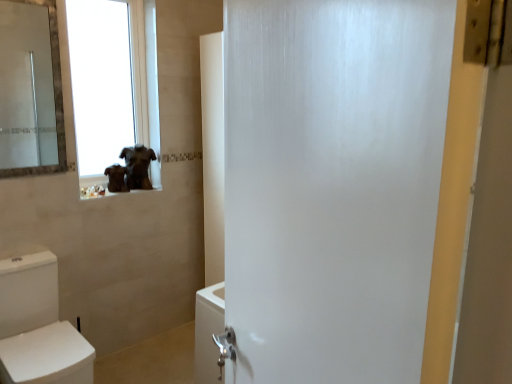
Question: Considering the relative sizes of transparent glass window at upper left and brown matte statue at upper left, marked as the 1th animal in a right-to-left arrangement, in the image provided, is transparent glass window at upper left taller than brown matte statue at upper left, marked as the 1th animal in a right-to-left arrangement,?

Choices:
 (A) no
 (B) yes

Answer: (B)

Question: Can you confirm if transparent glass window at upper left is positioned to the right of brown matte statue at upper left, the second animal positioned from the left?

Choices:
 (A) no
 (B) yes

Answer: (A)

Question: From the image's perspective, is transparent glass window at upper left above brown matte statue at upper left, marked as the 1th animal in a right-to-left arrangement?

Choices:
 (A) no
 (B) yes

Answer: (B)

Question: From a real-world perspective, is transparent glass window at upper left physically below brown matte statue at upper left, the second animal positioned from the left?

Choices:
 (A) yes
 (B) no

Answer: (B)

Question: From a real-world perspective, is transparent glass window at upper left on top of brown matte statue at upper left, marked as the 1th animal in a right-to-left arrangement?

Choices:
 (A) no
 (B) yes

Answer: (B)

Question: Considering the positions of brown matte statue at upper left, the second animal positioned from the left, and transparent glass window at upper left in the image, is brown matte statue at upper left, the second animal positioned from the left, wider or thinner than transparent glass window at upper left?

Choices:
 (A) wide
 (B) thin

Answer: (A)

Question: From the image's perspective, is brown matte statue at upper left, the second animal positioned from the left, located above or below transparent glass window at upper left?

Choices:
 (A) above
 (B) below

Answer: (B)

Question: Is point (135, 152) positioned closer to the camera than point (131, 1)?

Choices:
 (A) farther
 (B) closer

Answer: (A)

Question: From a real-world perspective, is brown matte statue at upper left, marked as the 1th animal in a right-to-left arrangement, physically located above or below transparent glass window at upper left?

Choices:
 (A) above
 (B) below

Answer: (B)

Question: In terms of width, does brown fur dog at upper left, which is counted as the second animal, starting from the right, look wider or thinner when compared to white glossy toilet at lower left?

Choices:
 (A) wide
 (B) thin

Answer: (B)

Question: Is brown fur dog at upper left, which is counted as the second animal, starting from the right, inside or outside of white glossy toilet at lower left?

Choices:
 (A) inside
 (B) outside

Answer: (B)

Question: Is brown fur dog at upper left, which is counted as the second animal, starting from the right, taller or shorter than white glossy toilet at lower left?

Choices:
 (A) short
 (B) tall

Answer: (A)

Question: In the image, is brown fur dog at upper left, the first animal viewed from the left, on the left side or the right side of white glossy toilet at lower left?

Choices:
 (A) left
 (B) right

Answer: (B)

Question: Considering the relative positions of brown fur dog at upper left, which is counted as the second animal, starting from the right, and brown matte statue at upper left, the second animal positioned from the left, in the image provided, is brown fur dog at upper left, which is counted as the second animal, starting from the right, to the left or to the right of brown matte statue at upper left, the second animal positioned from the left,?

Choices:
 (A) right
 (B) left

Answer: (B)

Question: In terms of height, does brown fur dog at upper left, which is counted as the second animal, starting from the right, look taller or shorter compared to brown matte statue at upper left, marked as the 1th animal in a right-to-left arrangement?

Choices:
 (A) tall
 (B) short

Answer: (B)